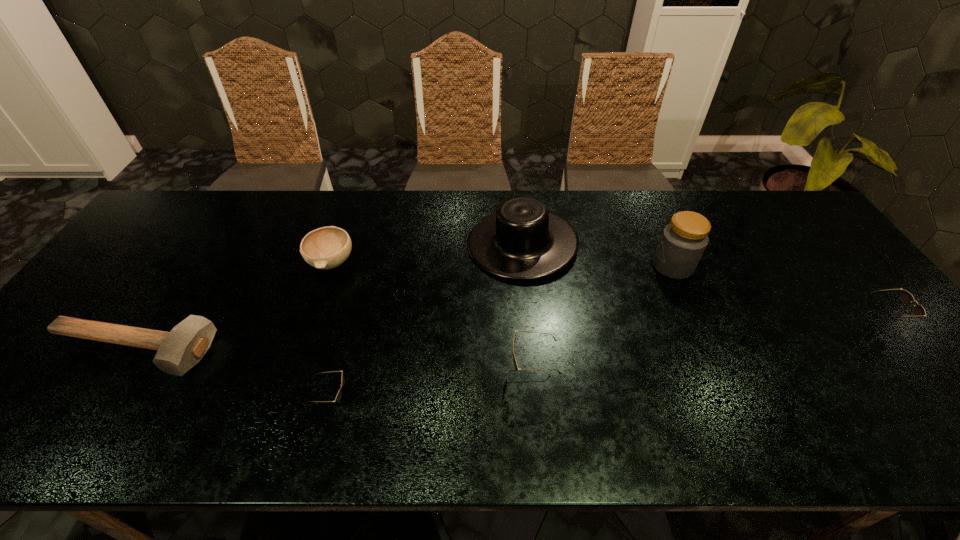
Find the location of a particular element. The width and height of the screenshot is (960, 540). the shortest sunglasses is located at coordinates (339, 394).

Locate an element on the screen. The width and height of the screenshot is (960, 540). the second sunglasses from right to left is located at coordinates (514, 354).

Identify the location of the rightmost object. The image size is (960, 540). (906, 297).

The width and height of the screenshot is (960, 540). Identify the location of the second shortest sunglasses. 906,297.

At what (x,y) coordinates should I click in order to perform the action: click on the sixth shortest object. Please return your answer as a coordinate pair (x, y). The width and height of the screenshot is (960, 540). Looking at the image, I should click on coord(522,240).

Identify the location of bowl. This screenshot has height=540, width=960. (328, 247).

Where is `jar`? Image resolution: width=960 pixels, height=540 pixels. jar is located at coordinates (683, 241).

At what (x,y) coordinates should I click in order to perform the action: click on the tallest object. Please return your answer as a coordinate pair (x, y). Looking at the image, I should click on (683, 241).

Locate an element on the screen. This screenshot has height=540, width=960. the shortest object is located at coordinates (179, 350).

At what (x,y) coordinates should I click in order to perform the action: click on the leftmost object. Please return your answer as a coordinate pair (x, y). Looking at the image, I should click on (x=179, y=350).